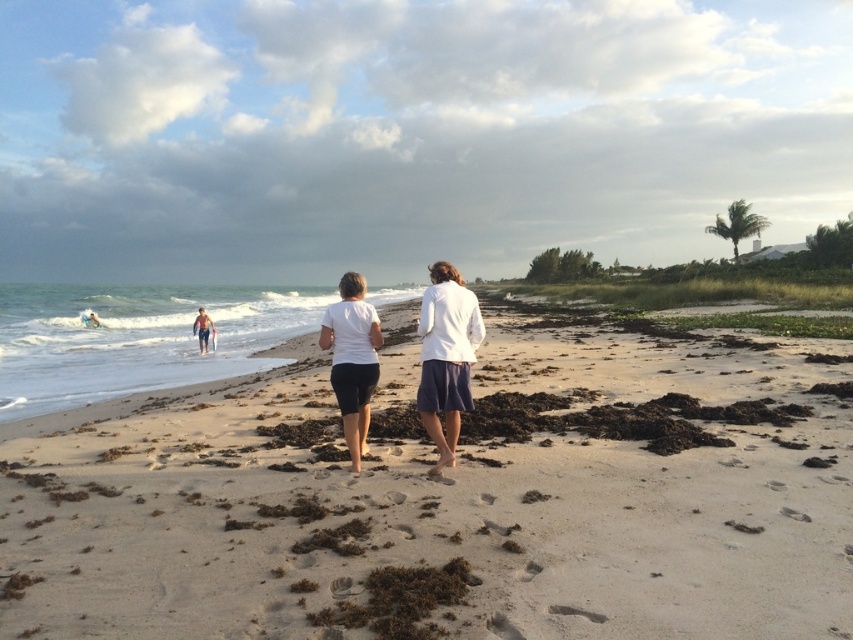
Who is higher up, light brown sand at center or white cotton shirts at center?

white cotton shirts at center is higher up.

Image resolution: width=853 pixels, height=640 pixels. What do you see at coordinates (450, 499) in the screenshot? I see `light brown sand at center` at bounding box center [450, 499].

Who is more distant from viewer, [42,557] or [444,404]?

The point [444,404] is more distant.

Locate an element on the screen. light brown sand at center is located at coordinates (450, 499).

Is light brown sand at center further to camera compared to white cotton shirt at center?

That is False.

Can you confirm if light brown sand at center is positioned to the right of white cotton shirt at center?

Indeed, light brown sand at center is positioned on the right side of white cotton shirt at center.

Between point (631, 488) and point (442, 376), which one is positioned in front?

Point (631, 488) is more forward.

Image resolution: width=853 pixels, height=640 pixels. Find the location of `light brown sand at center`. light brown sand at center is located at coordinates (450, 499).

Does white cotton shirts at center appear on the right side of white matte shorts at center?

Indeed, white cotton shirts at center is positioned on the right side of white matte shorts at center.

Is point (450, 339) positioned after point (338, 371)?

No, it is in front of (338, 371).

At what (x,y) coordinates should I click in order to perform the action: click on white cotton shirts at center. Please return your answer as a coordinate pair (x, y). Looking at the image, I should click on 445,356.